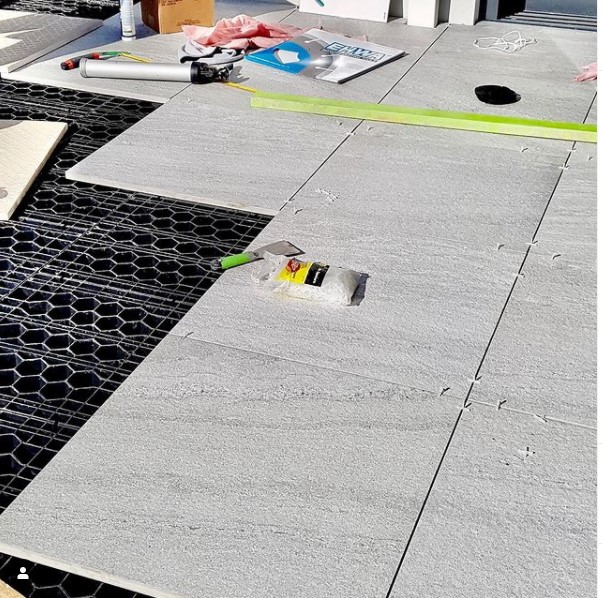
This screenshot has width=603, height=598. Identify the location of box. (171, 14).